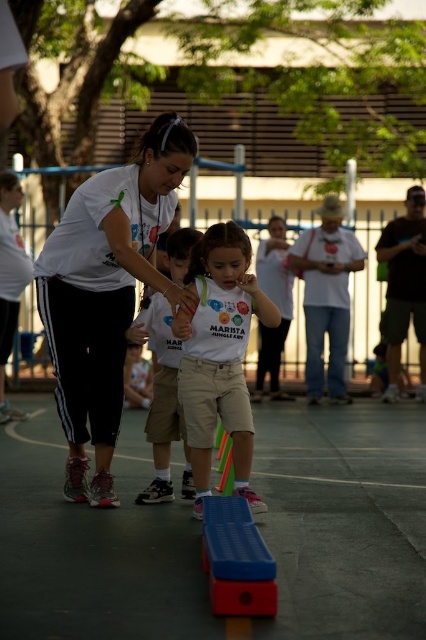
Question: Does white matte t-shirt at center appear over blue plastic bench at lower center?

Choices:
 (A) no
 (B) yes

Answer: (B)

Question: Is white matte t-shirt at center wider than white cotton shirt at center?

Choices:
 (A) yes
 (B) no

Answer: (A)

Question: Considering the real-world distances, which object is farthest from the white cotton shirt at center?

Choices:
 (A) white matte t-shirt at center
 (B) white matte shirt at center
 (C) blue plastic bench at lower center

Answer: (C)

Question: Considering the real-world distances, which object is farthest from the white cotton shirt at center?

Choices:
 (A) white matte t-shirt at center
 (B) blue plastic bench at lower center

Answer: (B)

Question: Can you confirm if white matte t-shirt at center is positioned above white cotton shirt at center?

Choices:
 (A) yes
 (B) no

Answer: (A)

Question: Which point appears farthest from the camera in this image?

Choices:
 (A) (198, 304)
 (B) (89, 410)

Answer: (B)